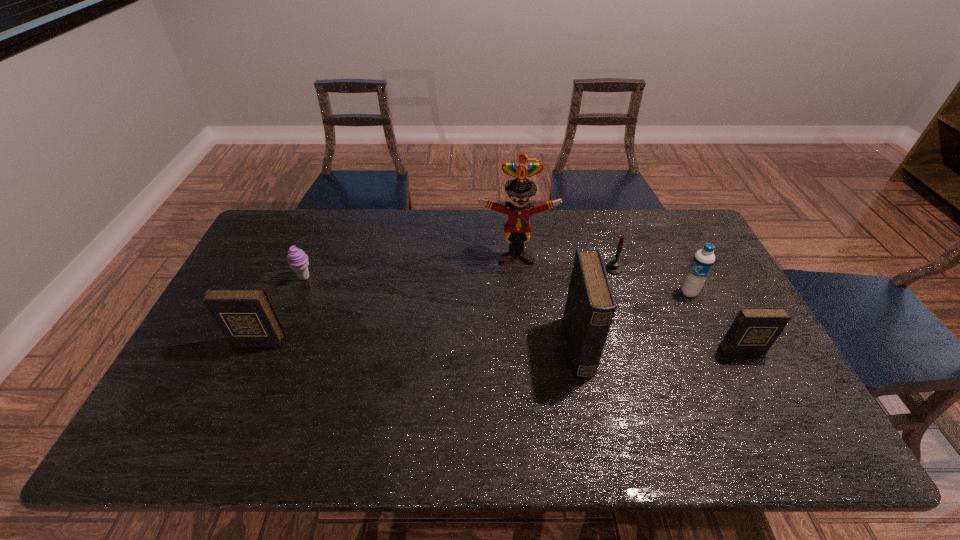
Where is `water bottle present at the right edge`? The width and height of the screenshot is (960, 540). water bottle present at the right edge is located at coordinates (703, 260).

In the image, there is a desktop. Identify the location of vacant space at the far edge. (369, 218).

Where is `vacant space at the near edge of the desktop`? vacant space at the near edge of the desktop is located at coordinates (640, 403).

In the image, there is a desktop. Where is `vacant space at the right edge`? Image resolution: width=960 pixels, height=540 pixels. vacant space at the right edge is located at coordinates (718, 343).

In the image, there is a desktop. Identify the location of vacant area at the far left corner. The height and width of the screenshot is (540, 960). (282, 237).

Where is `vacant region between the tallest diary and the shortest diary`? This screenshot has width=960, height=540. vacant region between the tallest diary and the shortest diary is located at coordinates (660, 348).

The height and width of the screenshot is (540, 960). I want to click on free spot between the sixth shortest object and the water bottle, so click(x=634, y=320).

You are a GUI agent. You are given a task and a screenshot of the screen. Output one action in this format:
    pyautogui.click(x=<x>, y=<y>)
    Task: Click on the vacant space in between the nutcracker and the icecream
    
    Given the screenshot: What is the action you would take?
    pyautogui.click(x=410, y=266)

This screenshot has width=960, height=540. Find the location of `vacant point located between the rightmost diary and the candle`. vacant point located between the rightmost diary and the candle is located at coordinates tap(678, 309).

Where is `free space between the tallest object and the shortest diary`? The height and width of the screenshot is (540, 960). free space between the tallest object and the shortest diary is located at coordinates (629, 302).